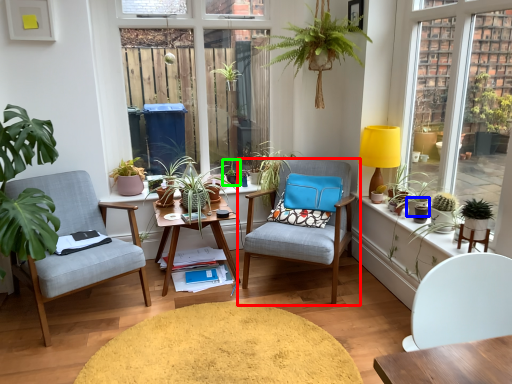
Question: Considering the real-world distances, which object is closest to chair (highlighted by a red box)? flowerpot (highlighted by a blue box) or houseplant (highlighted by a green box).

Choices:
 (A) flowerpot
 (B) houseplant

Answer: (B)